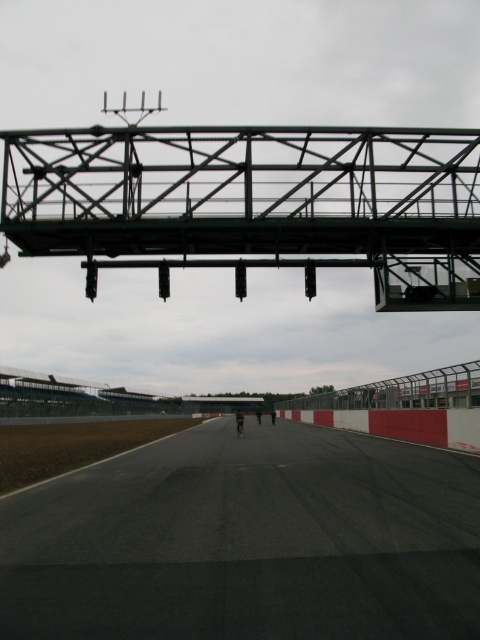
Between black asphalt runway at center and black fabric person at center, which one appears on the left side from the viewer's perspective?

black fabric person at center

Is black asphalt runway at center bigger than black fabric person at center?

Actually, black asphalt runway at center might be smaller than black fabric person at center.

Measure the distance between black asphalt runway at center and camera.

black asphalt runway at center and camera are 4.22 meters apart.

You are a GUI agent. You are given a task and a screenshot of the screen. Output one action in this format:
    pyautogui.click(x=<x>, y=<y>)
    Task: Click on the black asphalt runway at center
    This screenshot has width=480, height=640.
    Given the screenshot: What is the action you would take?
    pyautogui.click(x=248, y=541)

Does green metallic overpass at upper center have a smaller size compared to black fabric person at center?

Incorrect, green metallic overpass at upper center is not smaller in size than black fabric person at center.

What do you see at coordinates (254, 202) in the screenshot? I see `green metallic overpass at upper center` at bounding box center [254, 202].

Which is in front, point (109, 220) or point (238, 428)?

Point (109, 220)

Where is `green metallic overpass at upper center`? Image resolution: width=480 pixels, height=640 pixels. green metallic overpass at upper center is located at coordinates (254, 202).

Is black asphalt runway at center taller than green metallic overpass at upper center?

In fact, black asphalt runway at center may be shorter than green metallic overpass at upper center.

Does black asphalt runway at center have a larger size compared to green metallic overpass at upper center?

Actually, black asphalt runway at center might be smaller than green metallic overpass at upper center.

This screenshot has width=480, height=640. Find the location of `black asphalt runway at center`. black asphalt runway at center is located at coordinates (248, 541).